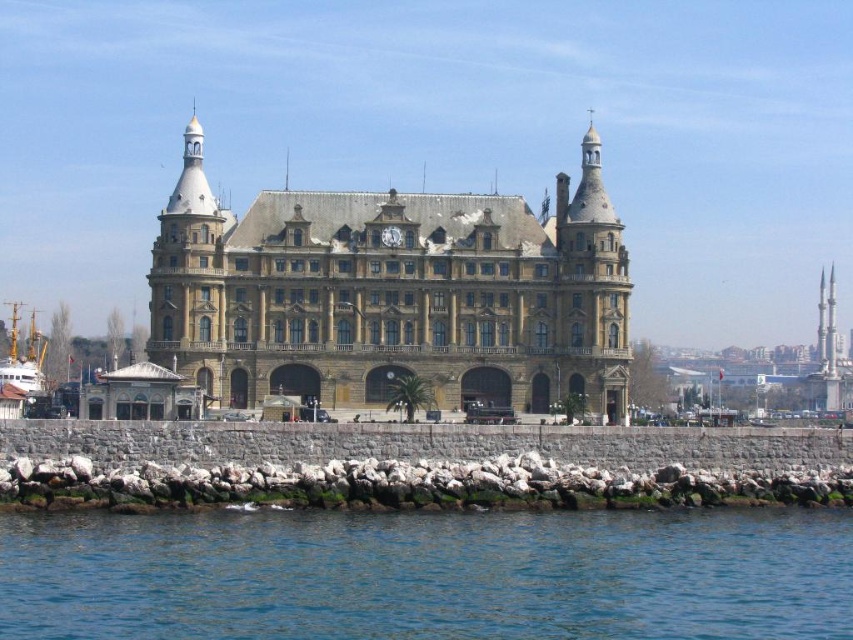
Is blue liquid water at lower center below brown stone building at center?

Indeed, blue liquid water at lower center is positioned under brown stone building at center.

Is blue liquid water at lower center shorter than brown stone building at center?

Correct, blue liquid water at lower center is not as tall as brown stone building at center.

Identify the location of blue liquid water at lower center. coord(428,576).

Based on the photo, does blue liquid water at lower center have a lesser width compared to wooden ship at lower left?

No.

Does blue liquid water at lower center have a lesser height compared to wooden ship at lower left?

Yes.

I want to click on blue liquid water at lower center, so click(428, 576).

Is brown stone building at center taller than wooden ship at lower left?

Yes, brown stone building at center is taller than wooden ship at lower left.

The image size is (853, 640). What do you see at coordinates (393, 292) in the screenshot?
I see `brown stone building at center` at bounding box center [393, 292].

The width and height of the screenshot is (853, 640). I want to click on brown stone building at center, so pyautogui.click(x=393, y=292).